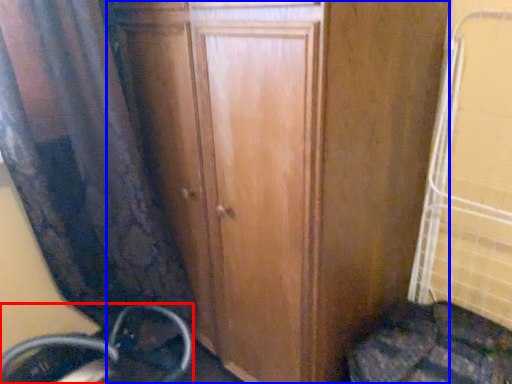
Question: Which point is further to the camera, wheel (highlighted by a red box) or door (highlighted by a blue box)?

Choices:
 (A) wheel
 (B) door

Answer: (A)